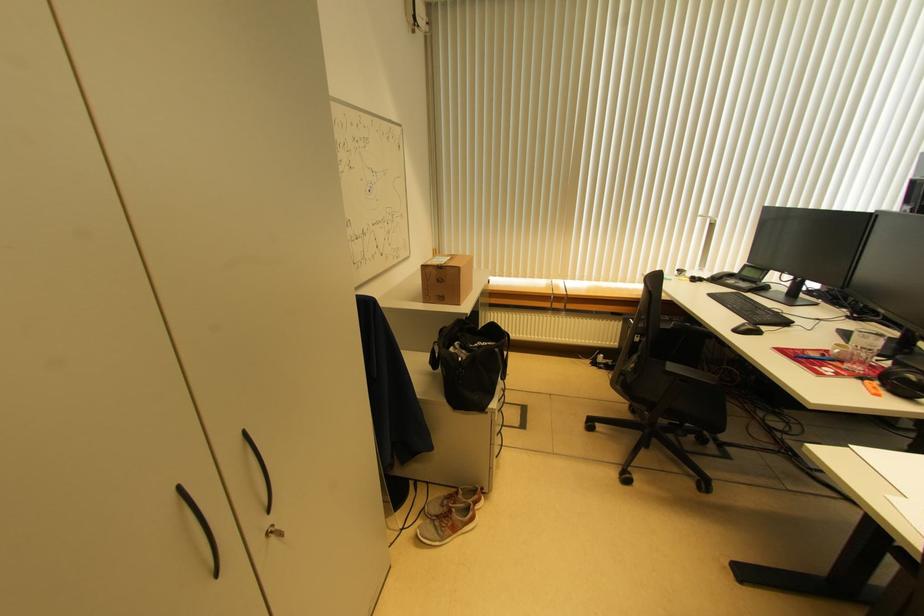
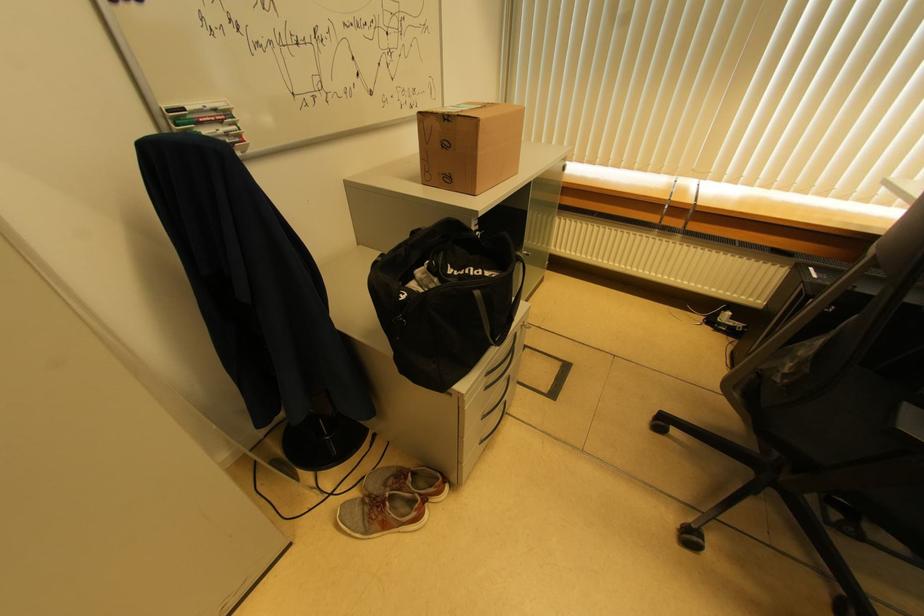
What movement of the cameraman would produce the second image?

The cameraman moved toward right, forward.